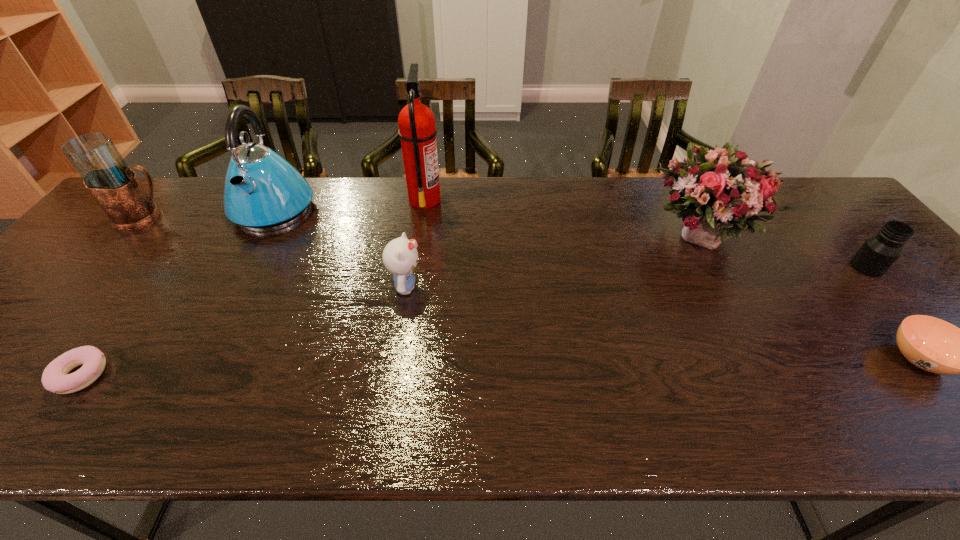
Identify the location of free region located at the spout of the second tallest object. The width and height of the screenshot is (960, 540). (208, 332).

I want to click on free region located on the front of the bouquet, so click(x=775, y=380).

Where is `vacant space located with the handle on the side of the leftmost object`? This screenshot has width=960, height=540. vacant space located with the handle on the side of the leftmost object is located at coordinates (276, 218).

You are a GUI agent. You are given a task and a screenshot of the screen. Output one action in this format:
    pyautogui.click(x=<x>, y=<y>)
    Task: Click on the vacant space located on the front-facing side of the kitten
    The height and width of the screenshot is (540, 960).
    Given the screenshot: What is the action you would take?
    pyautogui.click(x=483, y=287)

I want to click on free space located 0.070m on the left of the jar, so click(826, 267).

Identify the location of vacant area situated 0.070m on the front of the doughnut. The image size is (960, 540). (40, 432).

Where is `fire extinguisher located in the far edge section of the desktop`? fire extinguisher located in the far edge section of the desktop is located at coordinates (417, 131).

The height and width of the screenshot is (540, 960). I want to click on kettle that is at the far edge, so coord(263,192).

Where is `bouquet present at the far edge`? Image resolution: width=960 pixels, height=540 pixels. bouquet present at the far edge is located at coordinates (723, 192).

Image resolution: width=960 pixels, height=540 pixels. Identify the location of pitcher located in the far edge section of the desktop. (114, 185).